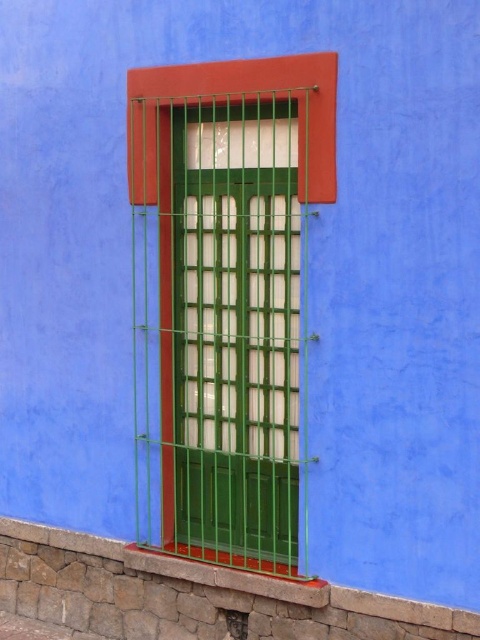
Is green metallic shutter at center wider than stone at lower left?

No.

Does point (190, 112) come farther from viewer compared to point (10, 596)?

No, (190, 112) is closer to viewer.

This screenshot has width=480, height=640. I want to click on green metallic shutter at center, so click(236, 330).